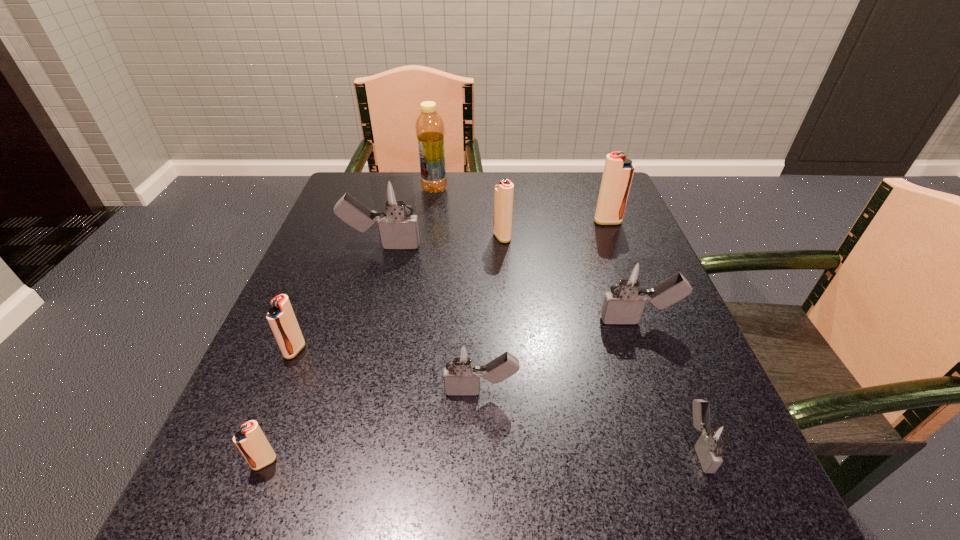
Image resolution: width=960 pixels, height=540 pixels. I want to click on the tallest object, so click(430, 132).

This screenshot has height=540, width=960. What are the coordinates of `bottle` in the screenshot? It's located at (430, 132).

Image resolution: width=960 pixels, height=540 pixels. In order to click on the biggest red igniter in this screenshot , I will do `click(618, 172)`.

Identify the location of the farthest igniter. (618, 172).

Locate an element on the screen. the biggest gray igniter is located at coordinates (394, 195).

You are a GUI agent. You are given a task and a screenshot of the screen. Output one action in this format:
    pyautogui.click(x=<x>, y=<y>)
    Task: Click on the farthest gray igniter
    The height and width of the screenshot is (540, 960).
    Given the screenshot: What is the action you would take?
    pyautogui.click(x=394, y=195)

Identify the location of the third nearest red igniter. The width and height of the screenshot is (960, 540). (503, 192).

This screenshot has width=960, height=540. I want to click on the second biggest red igniter, so click(503, 192).

Where is `the second farthest gray igniter`? This screenshot has height=540, width=960. the second farthest gray igniter is located at coordinates (630, 281).

Identify the location of the second biggest gray igniter. This screenshot has width=960, height=540. (630, 281).